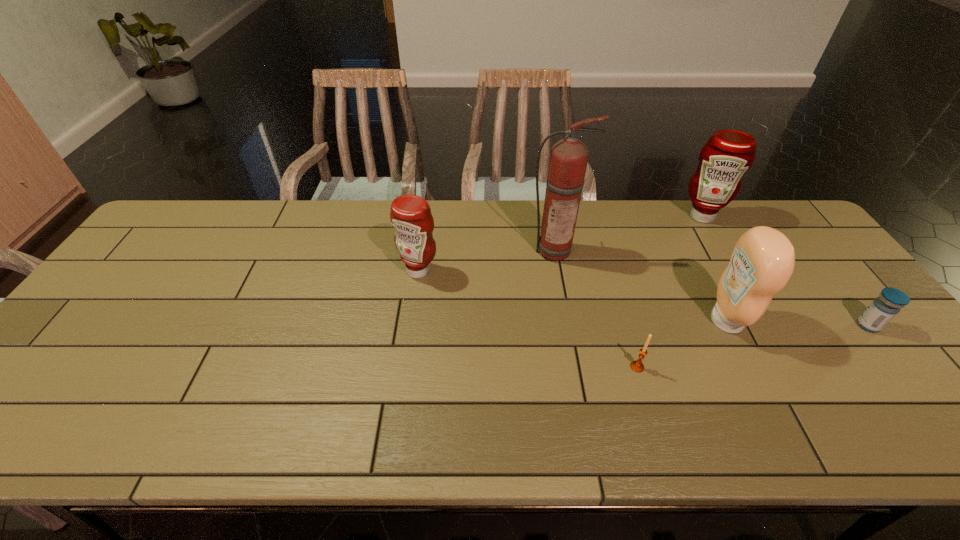
I want to click on free point that satisfies the following two spatial constraints: 1. on the side of the rightmost object with the label and nozzle; 2. on the left side of the fifth object from right to left, so click(x=567, y=326).

You are a GUI agent. You are given a task and a screenshot of the screen. Output one action in this format:
    pyautogui.click(x=<x>, y=<y>)
    Task: Click on the free point that satisfies the following two spatial constraints: 1. on the label of the medicine; 2. on the left side of the nearest condiment
    The height and width of the screenshot is (540, 960).
    Given the screenshot: What is the action you would take?
    pyautogui.click(x=729, y=326)